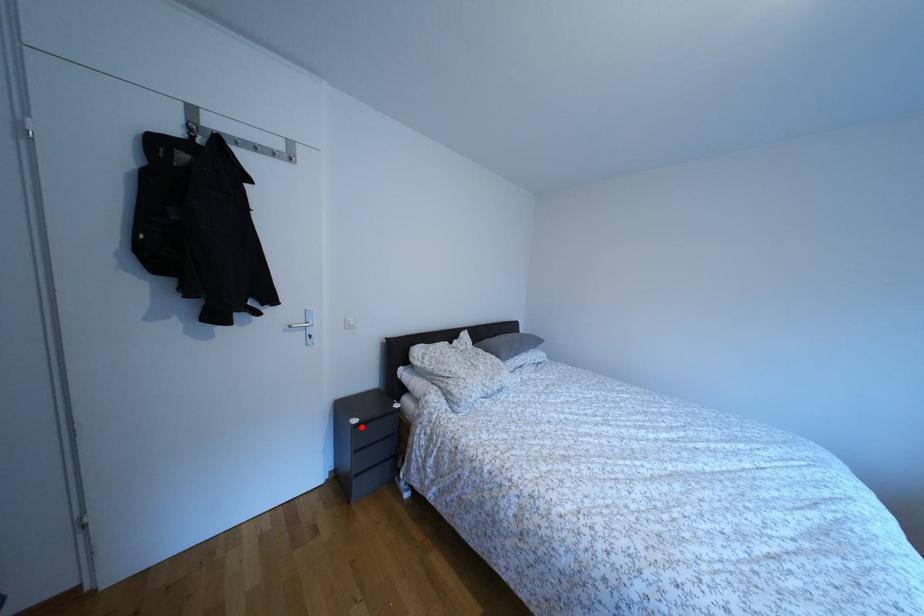
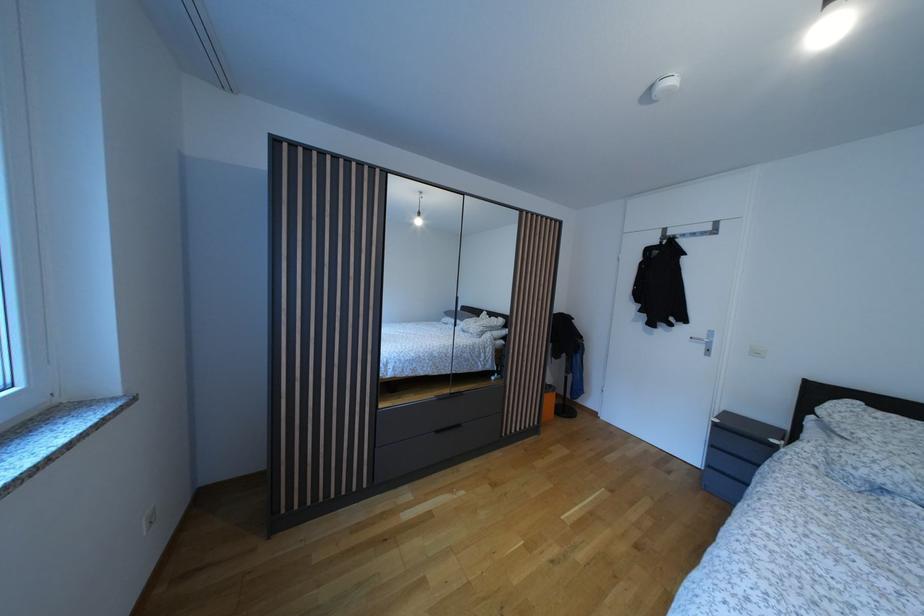
The point at the highlighted location is marked in the first image. Where is the corresponding point in the second image?

(723, 427)